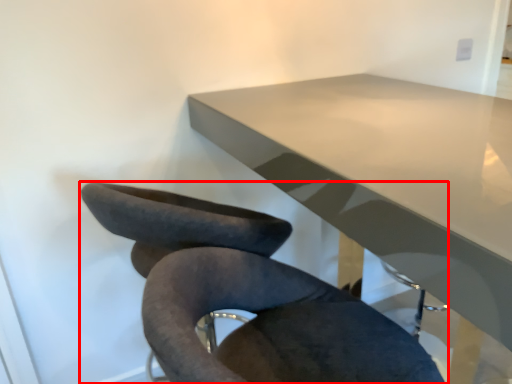
Question: From the image's perspective, what is the correct spatial positioning of chair (annotated by the red box) in reference to table?

Choices:
 (A) below
 (B) above

Answer: (A)